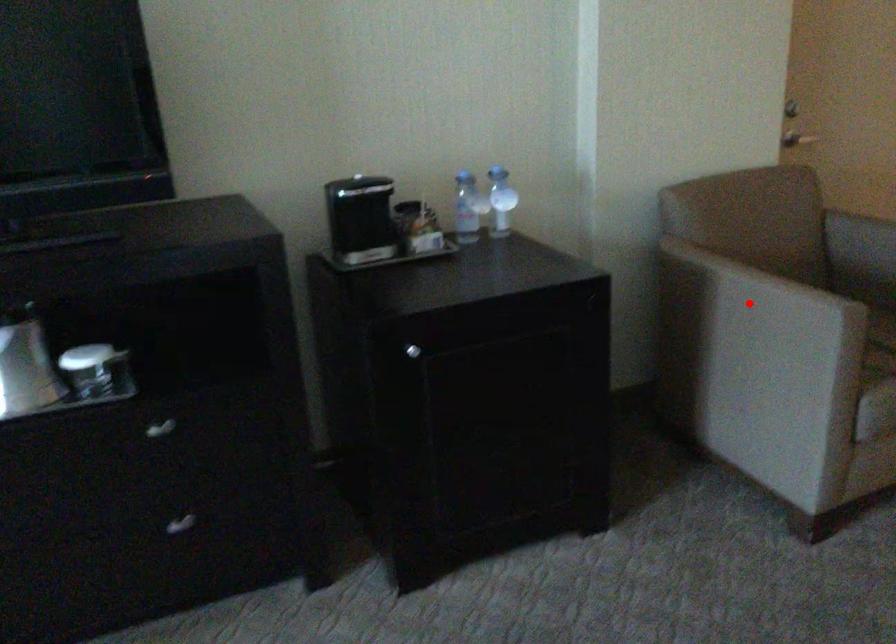
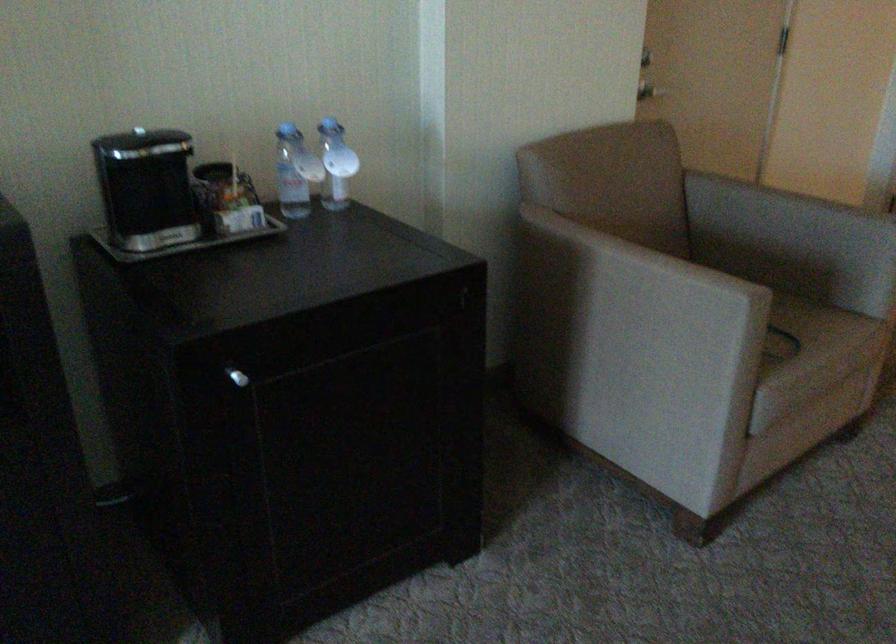
Locate, in the second image, the point that corresponds to the highlighted location in the first image.

(631, 283)